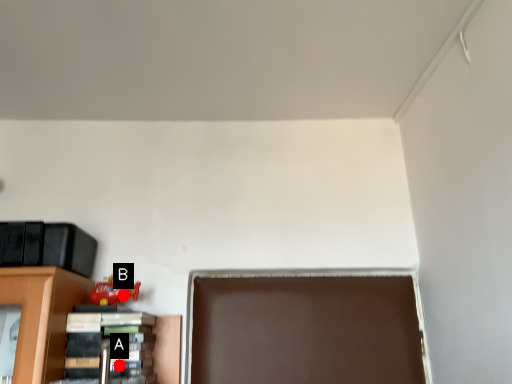
Question: Two points are circled on the image, labeled by A and B beside each circle. Which point is closer to the camera?

Choices:
 (A) A is closer
 (B) B is closer

Answer: (A)